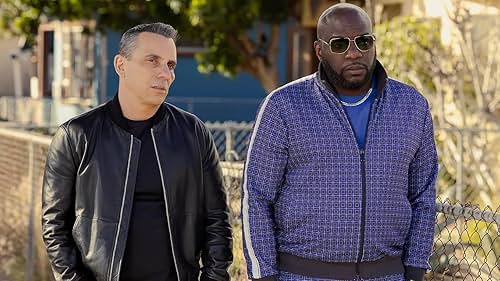
Find the location of `blue wall`. blue wall is located at coordinates (213, 83), (114, 43), (108, 81), (280, 46).